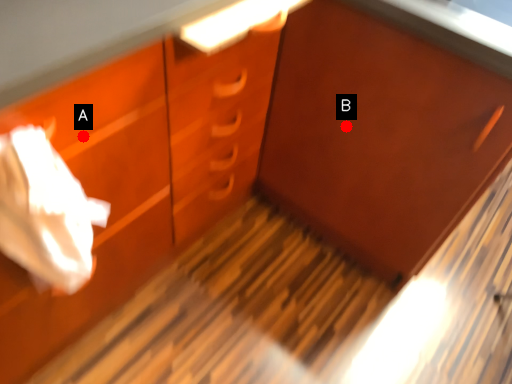
Question: Two points are circled on the image, labeled by A and B beside each circle. Among these points, which one is farthest from the camera?

Choices:
 (A) A is further
 (B) B is further

Answer: (B)